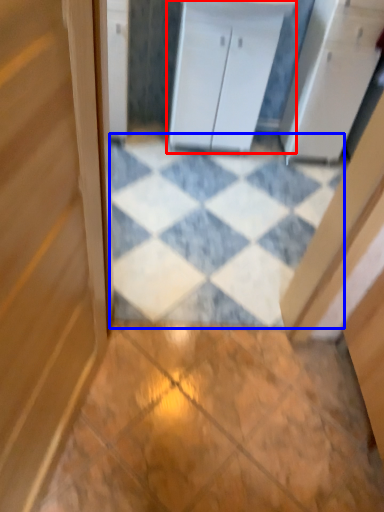
Question: Among these objects, which one is farthest to the camera, cabinetry (highlighted by a red box) or tile (highlighted by a blue box)?

Choices:
 (A) cabinetry
 (B) tile

Answer: (A)